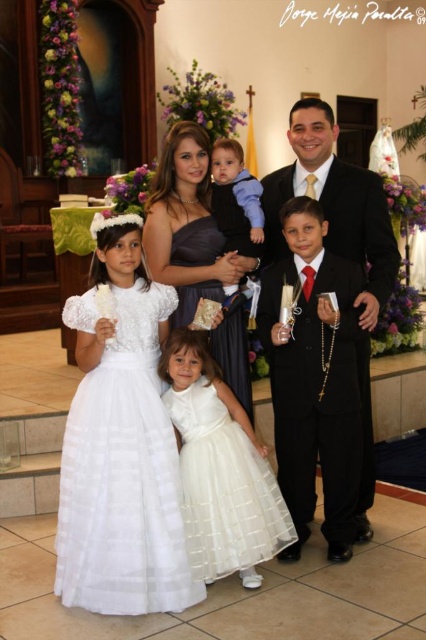
Who is taller, white tulle dress at center or dark blue velvet vest at center?

With more height is white tulle dress at center.

Image resolution: width=426 pixels, height=640 pixels. Describe the element at coordinates (224, 486) in the screenshot. I see `white tulle dress at center` at that location.

In order to click on white tulle dress at center in this screenshot , I will do [224, 486].

Can you confirm if black satin suit at right is smaller than matte dark blue dress at center?

Actually, black satin suit at right might be larger than matte dark blue dress at center.

Which is below, black satin suit at right or matte dark blue dress at center?

Positioned lower is black satin suit at right.

Measure the distance between black satin suit at right and camera.

The distance of black satin suit at right from camera is 3.55 meters.

The image size is (426, 640). In order to click on black satin suit at right in this screenshot , I will do `click(339, 236)`.

Is point (374, 177) closer to viewer compared to point (221, 193)?

Yes, it is in front of point (221, 193).

Is black satin suit at right to the right of dark blue velvet vest at center from the viewer's perspective?

Indeed, black satin suit at right is positioned on the right side of dark blue velvet vest at center.

This screenshot has width=426, height=640. In order to click on black satin suit at right in this screenshot , I will do `click(339, 236)`.